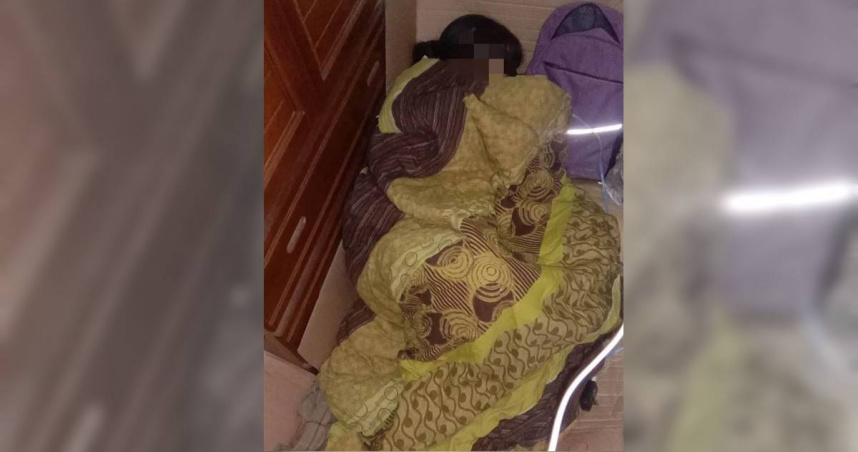
The image size is (858, 452). In order to click on white cord in this screenshot , I will do `click(565, 397)`.